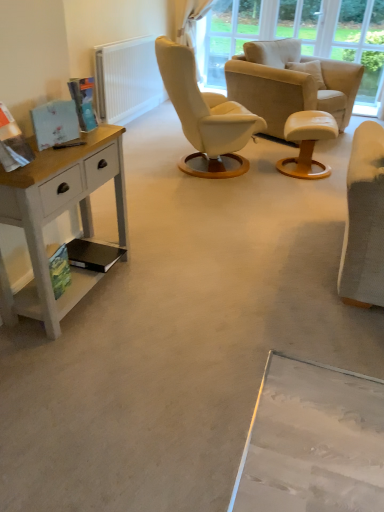
Locate an element on the screen. The height and width of the screenshot is (512, 384). vacant space in front of white painted wood desk at left is located at coordinates (76, 359).